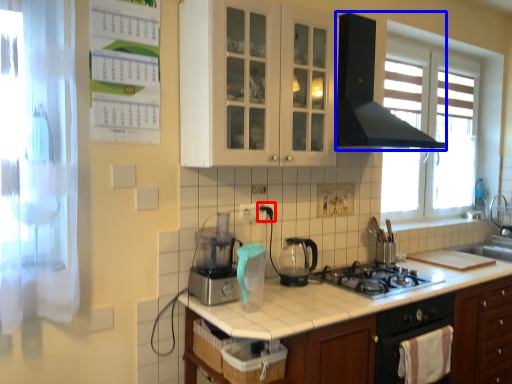
Question: Which object appears closest to the camera in this image, electric outlet (highlighted by a red box) or home appliance (highlighted by a blue box)?

Choices:
 (A) electric outlet
 (B) home appliance

Answer: (B)